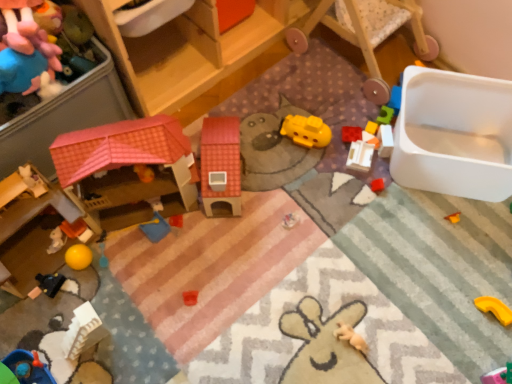
At what (x,y) coordinates should I click in order to perform the action: click on vacant space behind white plastic blocks at right, which is the second toy in right-to-left order. Please return your answer as a coordinate pair (x, y). This screenshot has width=512, height=384. Looking at the image, I should click on (356, 105).